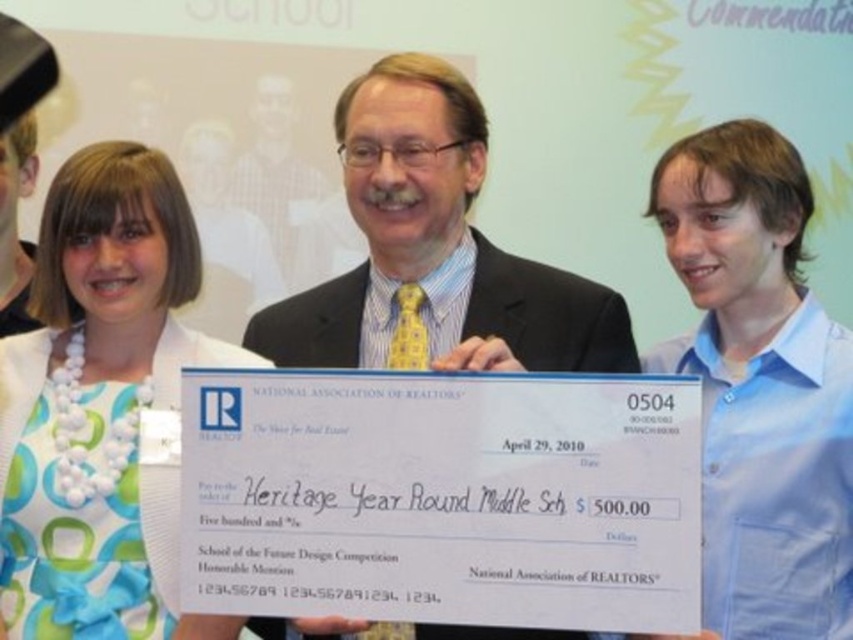
Based on the scene description, which object is positioned in front, the white pearl necklace at upper left or the white fabric dress at upper left?

The white pearl necklace at upper left is in front of the white fabric dress at upper left because the dress is behind the necklace.

You are attending a formal event and need to determine the spatial relationship between the matte black suit at center and the matte yellow tie at center. Based on the scene description, which object is located lower in the image?

The matte black suit at center is positioned under the matte yellow tie at center, so the matte black suit at center is located lower in the image.

You are a photographer at the event and need to capture a closeup of both the matte black suit at center and the matte yellow tie at center in one frame. Given that your camera has a depth of field that can focus on objects within a 3 feet range, will both items be in focus?

The matte black suit at center is 3.37 feet away from the matte yellow tie at center. Since the distance between them exceeds the 3 feet depth of field range, the camera may not be able to keep both in focus simultaneously.